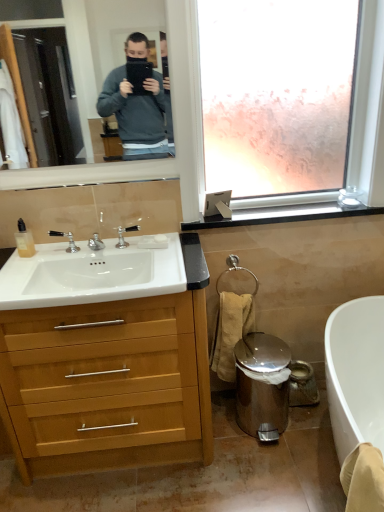
Identify the location of vacant space in between light wood/wooden cabinet at left and polished stainless steel trash can at lower right. (230, 441).